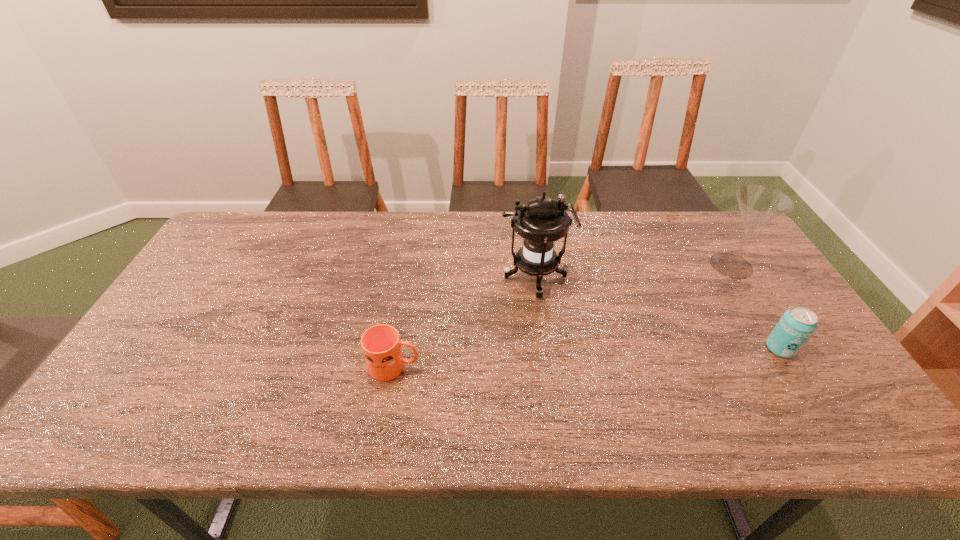
Identify the location of blank space that satisfies the following two spatial constraints: 1. on the front side of the beer can; 2. on the left side of the lantern. The image size is (960, 540). (543, 348).

What are the coordinates of `vacant space that satisfies the following two spatial constraints: 1. on the front side of the lantern; 2. on the handle side of the leftmost object` in the screenshot? It's located at (546, 367).